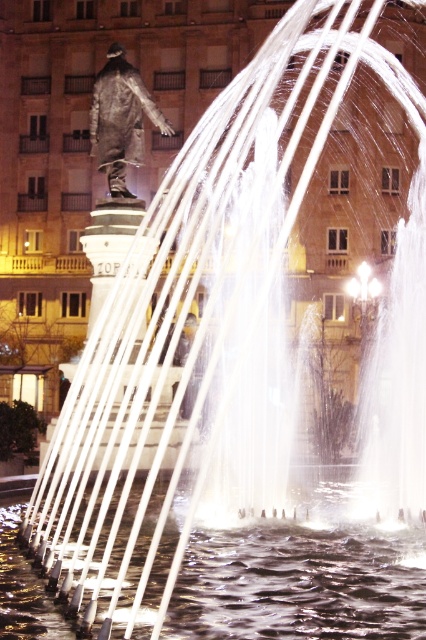
In the scene shown: You are standing in the park at night and see the clear liquid water at center and the bronze statue at upper left. Which object is positioned to the right of the other?

The clear liquid water at center is to the right of the bronze statue at upper left.

You are a drone operator who needs to fly a drone from the clear liquid water at center to the bronze statue at upper left. What is the minimum distance the drone must travel in meters?

The clear liquid water at center and bronze statue at upper left are 26.66 meters apart, so the minimum distance the drone must travel is 26.66 meters.

From the picture: You are a photographer aiming to capture the bronze statue at upper left and the clear liquid water at center in a single shot. Based on their positions, which object should you focus on first to ensure both are in frame?

The bronze statue at upper left is positioned above the clear liquid water at center, so you should focus on the bronze statue at upper left first to ensure both are in frame.